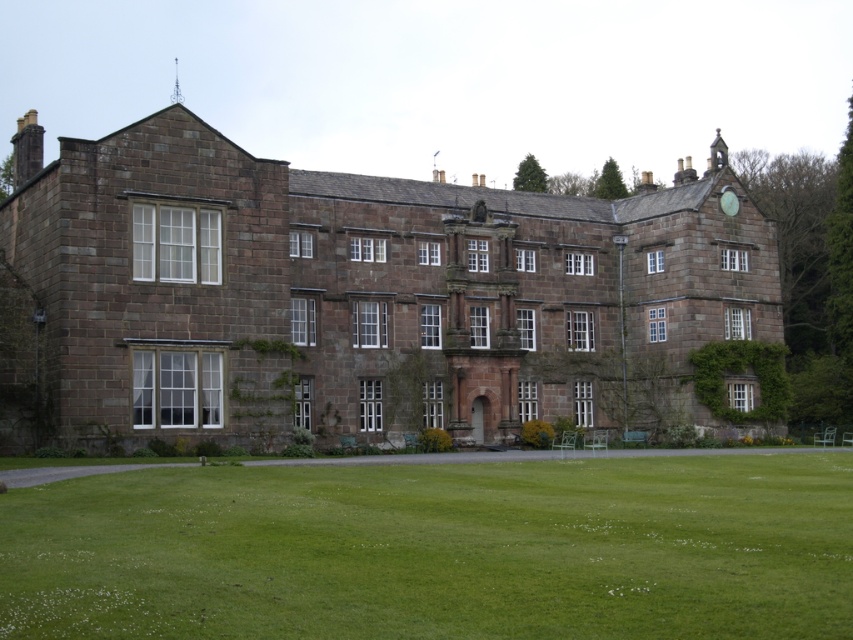
You are a landscape architect planning to install a new garden feature between the brown stone mansion at center and the green grass at lower center. Considering their heights, which object would you need to consider for visibility from the garden? Explain your reasoning.

The brown stone mansion at center is much taller than the green grass at lower center, so you would need to consider the mansion for visibility from the garden because its height could block the view or cast shadows over the garden area.

You are standing on the green grass at lower center in front of the brown stone mansion at center. If you want to enter the mansion, which direction should you walk towards?

You should walk towards the brown stone mansion at center, as it is positioned over the green grass at lower center where you are standing.

You are standing in front of the historic stone building and want to take a photo. You notice two points marked on the building at coordinates point (225, 220) and point (546, 541). Which point is closer to your camera lens?

Point (225, 220) is further to the camera than point (546, 541), so the point closer to the camera lens is point (546, 541).